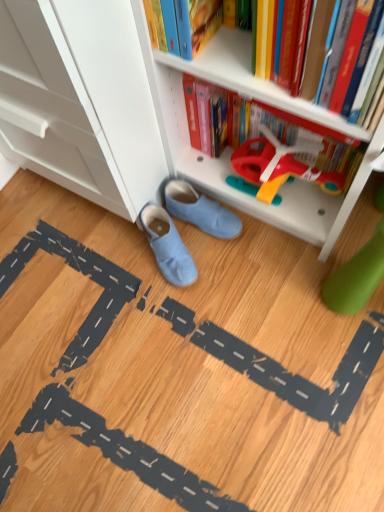
Find the location of a particular element. This screenshot has width=384, height=512. vacant area that lies between suede-like blue slippers at center, the 2th footwear in the bottom-to-top sequence, and light blue suede shoes at center, which appears as the second footwear when viewed from the top is located at coordinates (205, 253).